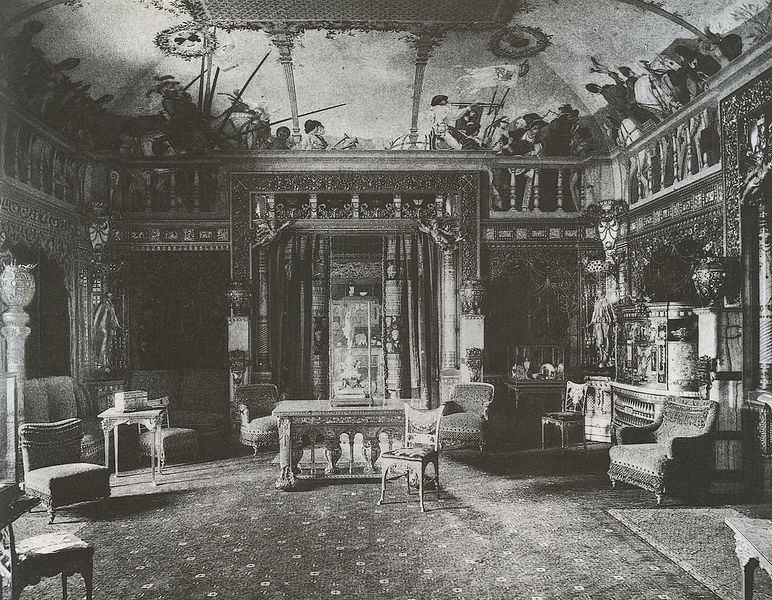
Locate an element on the screen. This screenshot has height=600, width=772. desk is located at coordinates (332, 420).